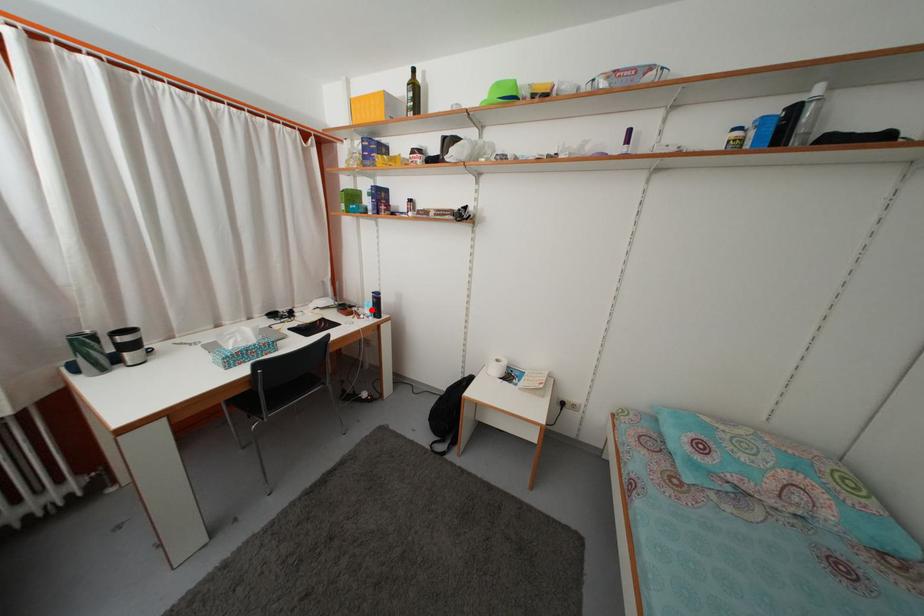
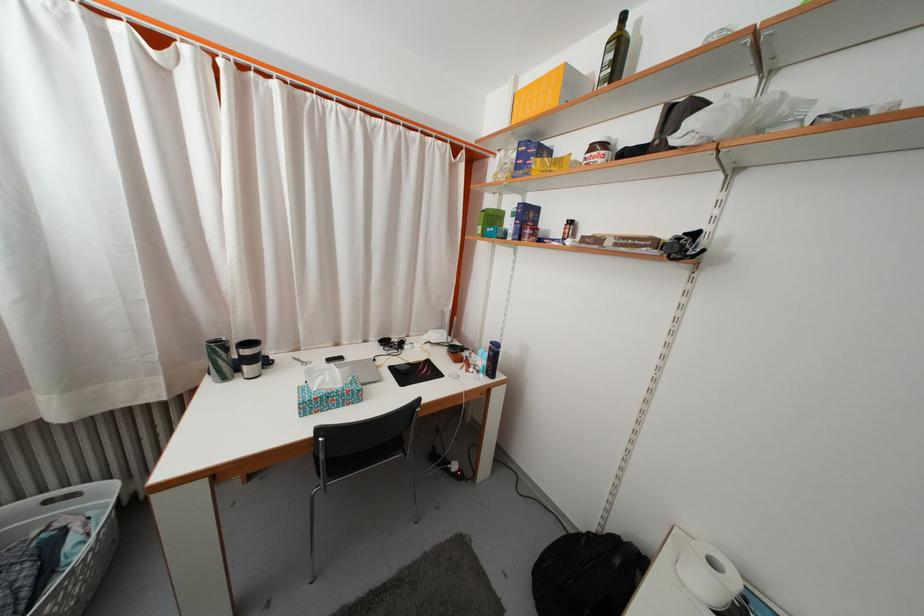
Find the pixel in the second image that matches the highlighted location in the first image.

(485, 359)